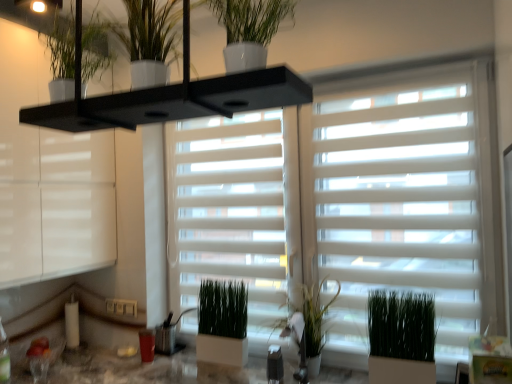
Question: Does green matte plant at upper center, the 5th houseplant when ordered from bottom to top, have a smaller size compared to white glossy window frame at upper left?

Choices:
 (A) yes
 (B) no

Answer: (A)

Question: Is green matte plant at upper center, which ranks as the first houseplant in top-to-bottom order, to the left of white glossy window frame at upper left from the viewer's perspective?

Choices:
 (A) yes
 (B) no

Answer: (B)

Question: Is green matte plant at upper center, which ranks as the first houseplant in top-to-bottom order, far away from white glossy window frame at upper left?

Choices:
 (A) no
 (B) yes

Answer: (B)

Question: Considering the relative sizes of green matte plant at upper center, which ranks as the first houseplant in top-to-bottom order, and white glossy window frame at upper left in the image provided, is green matte plant at upper center, which ranks as the first houseplant in top-to-bottom order, thinner than white glossy window frame at upper left?

Choices:
 (A) yes
 (B) no

Answer: (A)

Question: Can you confirm if green matte plant at upper center, which is the 2th houseplant in front-to-back order, is positioned to the right of white glossy window frame at upper left?

Choices:
 (A) no
 (B) yes

Answer: (B)

Question: Considering the positions of green matte plant at center, which is counted as the 1th houseplant, starting from the back, and green matte plant at center, which is the 3th houseplant in front-to-back order, in the image, is green matte plant at center, which is counted as the 1th houseplant, starting from the back, taller or shorter than green matte plant at center, which is the 3th houseplant in front-to-back order,?

Choices:
 (A) short
 (B) tall

Answer: (B)

Question: From a real-world perspective, relative to green matte plant at center, which is the 3th houseplant in front-to-back order, is green matte plant at center, which is counted as the 5th houseplant, starting from the top, vertically above or below?

Choices:
 (A) below
 (B) above

Answer: (B)

Question: Considering the positions of point (202, 284) and point (410, 370), is point (202, 284) closer or farther from the camera than point (410, 370)?

Choices:
 (A) farther
 (B) closer

Answer: (A)

Question: Based on their sizes in the image, would you say green matte plant at center, which is counted as the 1th houseplant, starting from the back, is bigger or smaller than green matte plant at center, which is the 3th houseplant in front-to-back order?

Choices:
 (A) big
 (B) small

Answer: (B)

Question: From their relative heights in the image, would you say white matte window blind at center is taller or shorter than white glossy window frame at upper left?

Choices:
 (A) tall
 (B) short

Answer: (A)

Question: From a real-world perspective, relative to white glossy window frame at upper left, is white matte window blind at center vertically above or below?

Choices:
 (A) above
 (B) below

Answer: (B)

Question: Looking at their shapes, would you say white matte window blind at center is wider or thinner than white glossy window frame at upper left?

Choices:
 (A) thin
 (B) wide

Answer: (A)

Question: From the image's perspective, is white matte window blind at center positioned above or below white glossy window frame at upper left?

Choices:
 (A) above
 (B) below

Answer: (B)

Question: Is white matte window blind at center bigger or smaller than white glossy pot at upper center, the first houseplant positioned from the front?

Choices:
 (A) big
 (B) small

Answer: (A)

Question: Is white matte window blind at center to the left or to the right of white glossy pot at upper center, the 4th houseplant from the bottom, in the image?

Choices:
 (A) right
 (B) left

Answer: (A)